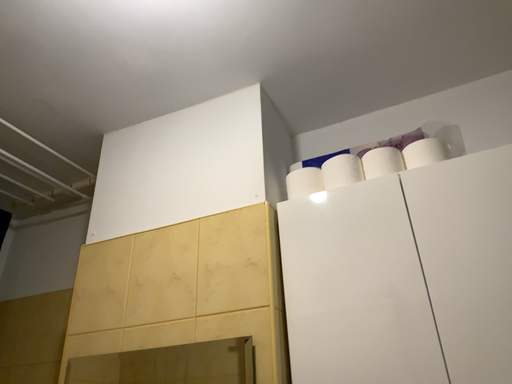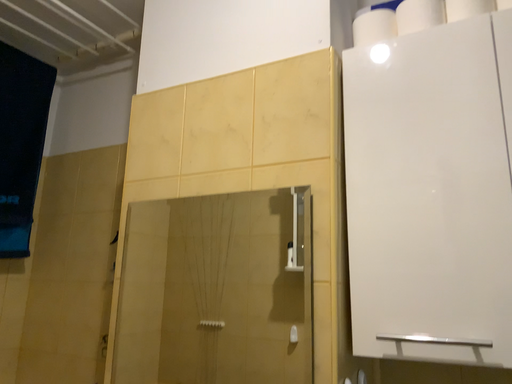
Question: Which way did the camera rotate in the video?

Choices:
 (A) rotated downward
 (B) rotated upward

Answer: (A)